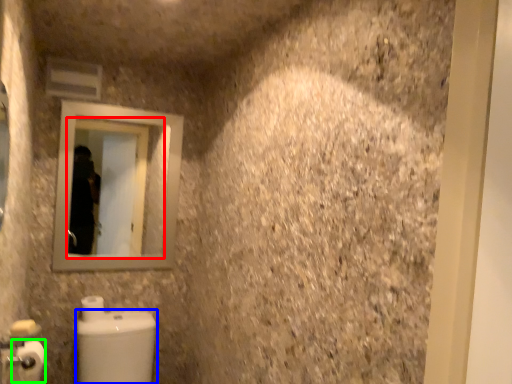
Question: Considering the real-world distances, which object is closest to mirror (highlighted by a red box)? toilet bowl (highlighted by a blue box) or toilet paper (highlighted by a green box).

Choices:
 (A) toilet bowl
 (B) toilet paper

Answer: (A)